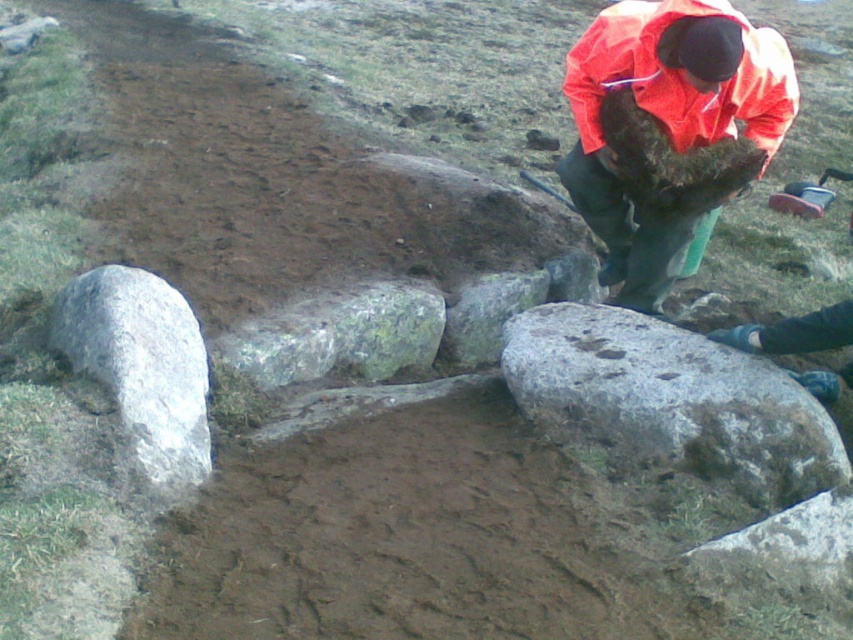
Question: Is gray rough stone at center above orange waterproof jacket at upper right?

Choices:
 (A) yes
 (B) no

Answer: (B)

Question: Which is farther from the orange waterproof jacket at upper right?

Choices:
 (A) gray rough rock at lower left
 (B) gray rough stone at center

Answer: (A)

Question: Does gray rough stone at center appear on the right side of gray rough rock at lower left?

Choices:
 (A) no
 (B) yes

Answer: (B)

Question: Is the position of orange waterproof jacket at upper right less distant than that of gray rough rock at lower left?

Choices:
 (A) yes
 (B) no

Answer: (B)

Question: Which point appears closest to the camera in this image?

Choices:
 (A) (664, 444)
 (B) (149, 422)
 (C) (610, 180)

Answer: (B)

Question: Among these objects, which one is farthest from the camera?

Choices:
 (A) gray rough stone at center
 (B) orange waterproof jacket at upper right

Answer: (B)